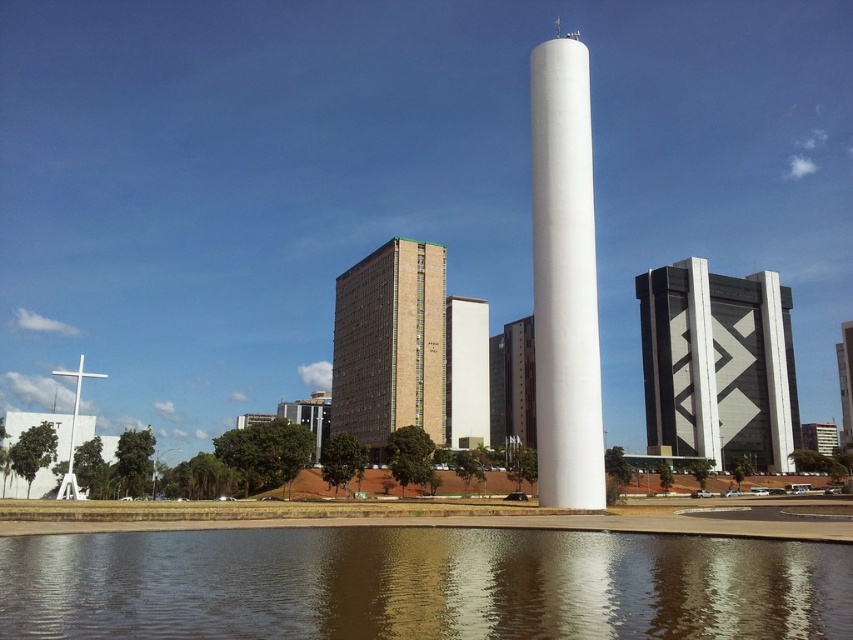
Does black glass building at right appear on the left side of white smooth tower at center?

Incorrect, black glass building at right is not on the left side of white smooth tower at center.

Between point (672, 324) and point (469, 429), which one is positioned in front?

Point (469, 429) is more forward.

Find the location of a particular element. black glass building at right is located at coordinates (718, 365).

From the picture: Is smooth reflective water at center smaller than brown textured building at center?

Yes.

From the picture: Does smooth reflective water at center appear over brown textured building at center?

Actually, smooth reflective water at center is below brown textured building at center.

Which is behind, point (502, 605) or point (409, 417)?

The point (409, 417) is more distant.

Where is `smooth reflective water at center`? smooth reflective water at center is located at coordinates (421, 586).

Based on the photo, which is below, white smooth obelisk at center or white matte cross at left?

white matte cross at left is below.

I want to click on white smooth obelisk at center, so click(564, 280).

At what (x,y) coordinates should I click in order to perform the action: click on white smooth obelisk at center. Please return your answer as a coordinate pair (x, y). Looking at the image, I should click on (564, 280).